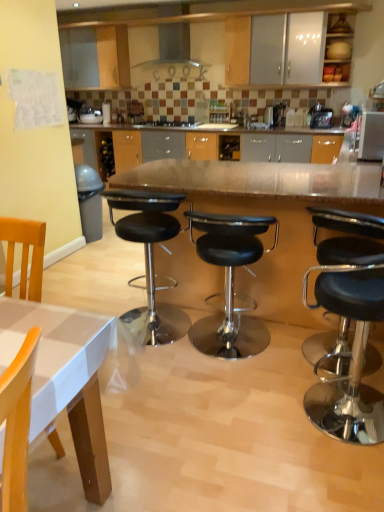
The width and height of the screenshot is (384, 512). What do you see at coordinates (230, 283) in the screenshot?
I see `black leather stool at center, positioned as the 2th stool in left-to-right order` at bounding box center [230, 283].

What do you see at coordinates (24, 254) in the screenshot?
I see `wooden chair at lower left` at bounding box center [24, 254].

The height and width of the screenshot is (512, 384). Find the location of `wooden chair at lower left`. wooden chair at lower left is located at coordinates (24, 254).

Image resolution: width=384 pixels, height=512 pixels. I want to click on black glass stove at center, so click(172, 123).

What do you see at coordinates (172, 123) in the screenshot?
I see `black glass stove at center` at bounding box center [172, 123].

What do you see at coordinates (150, 261) in the screenshot? I see `black leather stool at center, which is counted as the third stool, starting from the right` at bounding box center [150, 261].

The height and width of the screenshot is (512, 384). What do you see at coordinates (338, 49) in the screenshot?
I see `matte wood cabinet at upper right` at bounding box center [338, 49].

The image size is (384, 512). What do you see at coordinates (371, 136) in the screenshot?
I see `satin silver microwave at upper right` at bounding box center [371, 136].

Identify the location of polished wood table at center. Image resolution: width=384 pixels, height=512 pixels. (268, 206).

Considering the relative positions of black leather stool at center, which is counted as the first stool, starting from the left, and satin silver microwave at upper right in the image provided, is black leather stool at center, which is counted as the first stool, starting from the left, in front of satin silver microwave at upper right?

Yes, black leather stool at center, which is counted as the first stool, starting from the left, is closer to the viewer.

Is black leather stool at center, which is counted as the third stool, starting from the right, directly adjacent to satin silver microwave at upper right?

black leather stool at center, which is counted as the third stool, starting from the right, is not next to satin silver microwave at upper right, and they're not touching.

How many degrees apart are the facing directions of black leather stool at center, which is counted as the third stool, starting from the right, and satin silver microwave at upper right?

The angular difference between black leather stool at center, which is counted as the third stool, starting from the right, and satin silver microwave at upper right is 90 degrees.

From a real-world perspective, is black leather stool at center, which is counted as the first stool, starting from the left, under satin silver microwave at upper right?

Yes, from a real-world perspective, black leather stool at center, which is counted as the first stool, starting from the left, is under satin silver microwave at upper right.

Consider the image. From a real-world perspective, is polished wood table at center physically below black leather stool at center, which is counted as the third stool, starting from the right?

Yes, from a real-world perspective, polished wood table at center is below black leather stool at center, which is counted as the third stool, starting from the right.

Looking at this image, is polished wood table at center further to the viewer compared to black leather stool at center, which is counted as the third stool, starting from the right?

No, it is in front of black leather stool at center, which is counted as the third stool, starting from the right.

From the picture: From the image's perspective, relative to black leather stool at center, which is counted as the third stool, starting from the right, is polished wood table at center above or below?

Based on their image positions, polished wood table at center is located above black leather stool at center, which is counted as the third stool, starting from the right.

Does point (238, 183) appear closer or farther from the camera than point (129, 191)?

Point (238, 183) appears to be farther away from the viewer than point (129, 191).

Which object is wider, wooden chair at lower left or black leather stool at center, which is counted as the third stool, starting from the right?

black leather stool at center, which is counted as the third stool, starting from the right.

Is wooden chair at lower left in front of or behind black leather stool at center, which is counted as the third stool, starting from the right, in the image?

wooden chair at lower left is in front of black leather stool at center, which is counted as the third stool, starting from the right.

From the picture: Can you confirm if wooden chair at lower left is taller than black leather stool at center, which is counted as the first stool, starting from the left?

No, wooden chair at lower left is not taller than black leather stool at center, which is counted as the first stool, starting from the left.

From a real-world perspective, which object stands above the other?

In real-world perspective, wooden chair at lower left is above.

Are matte wood cabinet at upper right and polished wood table at center beside each other?

No, matte wood cabinet at upper right is not beside polished wood table at center.

The height and width of the screenshot is (512, 384). What are the coordinates of `table below the matte wood cabinet at upper right (from the image's perspective)` in the screenshot? It's located at (268, 206).

Does matte wood cabinet at upper right appear on the right side of polished wood table at center?

Yes, matte wood cabinet at upper right is to the right of polished wood table at center.

From a real-world perspective, is matte wood cabinet at upper right above or below polished wood table at center?

In terms of real-world spatial position, matte wood cabinet at upper right is above polished wood table at center.

I want to click on stove above the black leather stool at center, which is counted as the third stool, starting from the right (from a real-world perspective), so click(172, 123).

What's the angular difference between black glass stove at center and black leather stool at center, which is counted as the first stool, starting from the left,'s facing directions?

black glass stove at center and black leather stool at center, which is counted as the first stool, starting from the left, are facing 178 degrees away from each other.

Would you say black glass stove at center is to the left or to the right of black leather stool at center, which is counted as the first stool, starting from the left, in the picture?

black glass stove at center is to the left of black leather stool at center, which is counted as the first stool, starting from the left.

In the scene shown: Is black glass stove at center next to black leather stool at center, which is counted as the third stool, starting from the right, and touching it?

No, black glass stove at center is not in contact with black leather stool at center, which is counted as the third stool, starting from the right.

Can you confirm if black glass stove at center is wider than wooden chair at lower left?

Correct, the width of black glass stove at center exceeds that of wooden chair at lower left.

Is black glass stove at center shorter than wooden chair at lower left?

Yes.

Looking at this image, is black glass stove at center to the left of wooden chair at lower left from the viewer's perspective?

Incorrect, black glass stove at center is not on the left side of wooden chair at lower left.

Considering the sizes of black glass stove at center and wooden chair at lower left in the image, is black glass stove at center bigger or smaller than wooden chair at lower left?

In the image, black glass stove at center appears to be smaller than wooden chair at lower left.

Can you confirm if black leather stool at center, the 2th stool viewed from the right, is wider than black leather stool at center, which is counted as the third stool, starting from the right?

Indeed, black leather stool at center, the 2th stool viewed from the right, has a greater width compared to black leather stool at center, which is counted as the third stool, starting from the right.

Which is more to the left, black leather stool at center, positioned as the 2th stool in left-to-right order, or black leather stool at center, which is counted as the third stool, starting from the right?

black leather stool at center, which is counted as the third stool, starting from the right.

Who is smaller, black leather stool at center, the 2th stool viewed from the right, or black leather stool at center, which is counted as the third stool, starting from the right?

Smaller between the two is black leather stool at center, the 2th stool viewed from the right.

Is black leather stool at center, the 2th stool viewed from the right, oriented away from black leather stool at center, which is counted as the first stool, starting from the left?

black leather stool at center, the 2th stool viewed from the right, does not have its back to black leather stool at center, which is counted as the first stool, starting from the left.

I want to click on the 1st stool in front of the satin silver microwave at upper right, counting from the anchor's position, so click(x=150, y=261).

Identify the location of table on the right side of black leather stool at center, which is counted as the third stool, starting from the right. (268, 206).

Considering their positions, is black glass stove at center positioned further to black leather stool at center, which is counted as the third stool, starting from the right, than matte wood cabinet at upper right?

matte wood cabinet at upper right is further to black leather stool at center, which is counted as the third stool, starting from the right.

Estimate the real-world distances between objects in this image. Which object is further from black leather stool at center, which is counted as the first stool, starting from the left, matte wood cabinet at upper right or satin silver microwave at upper right?

matte wood cabinet at upper right lies further to black leather stool at center, which is counted as the first stool, starting from the left, than the other object.

Based on their spatial positions, is black leather stool at right, which is the third stool from left to right, or polished wood table at center closer to black leather stool at center, which is counted as the first stool, starting from the left?

polished wood table at center lies closer to black leather stool at center, which is counted as the first stool, starting from the left, than the other object.

Estimate the real-world distances between objects in this image. Which object is closer to black leather stool at center, positioned as the 2th stool in left-to-right order, black glass stove at center or satin silver microwave at upper right?

The object closer to black leather stool at center, positioned as the 2th stool in left-to-right order, is satin silver microwave at upper right.

Considering their positions, is black leather stool at center, the 2th stool viewed from the right, positioned further to polished wood table at center than black glass stove at center?

black glass stove at center is positioned further to the anchor polished wood table at center.

Based on their spatial positions, is wooden chair at lower left or black leather stool at center, which is counted as the first stool, starting from the left, further from black glass stove at center?

wooden chair at lower left is further to black glass stove at center.

Consider the image. When comparing their distances from black leather stool at center, positioned as the 2th stool in left-to-right order, does black leather stool at right, which is the third stool from left to right, or polished wood table at center seem closer?

polished wood table at center.

Which object lies further to the anchor point black leather stool at right, which is counted as the 1th stool, starting from the right, black leather stool at center, which is counted as the first stool, starting from the left, or polished wood table at center?

black leather stool at center, which is counted as the first stool, starting from the left, is positioned further to the anchor black leather stool at right, which is counted as the 1th stool, starting from the right.

You are a GUI agent. You are given a task and a screenshot of the screen. Output one action in this format:
    pyautogui.click(x=<x>, y=<y>)
    Task: Click on the cabinetry positioned between polished wood table at center and black glass stove at center from near to far
    
    Given the screenshot: What is the action you would take?
    pyautogui.click(x=338, y=49)

This screenshot has height=512, width=384. I want to click on cabinetry positioned between black leather stool at center, the 2th stool viewed from the right, and black glass stove at center from near to far, so click(338, 49).

The width and height of the screenshot is (384, 512). Identify the location of appliance between black leather stool at right, which is counted as the 1th stool, starting from the right, and black glass stove at center, along the z-axis. (371, 136).

In order to click on appliance positioned between polished wood table at center and black glass stove at center from near to far in this screenshot , I will do 371,136.